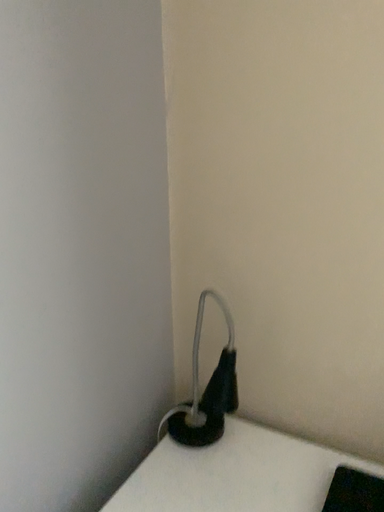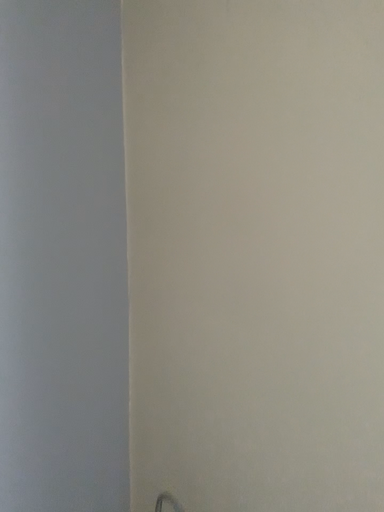
Question: Which way did the camera rotate in the video?

Choices:
 (A) rotated upward
 (B) rotated downward

Answer: (A)